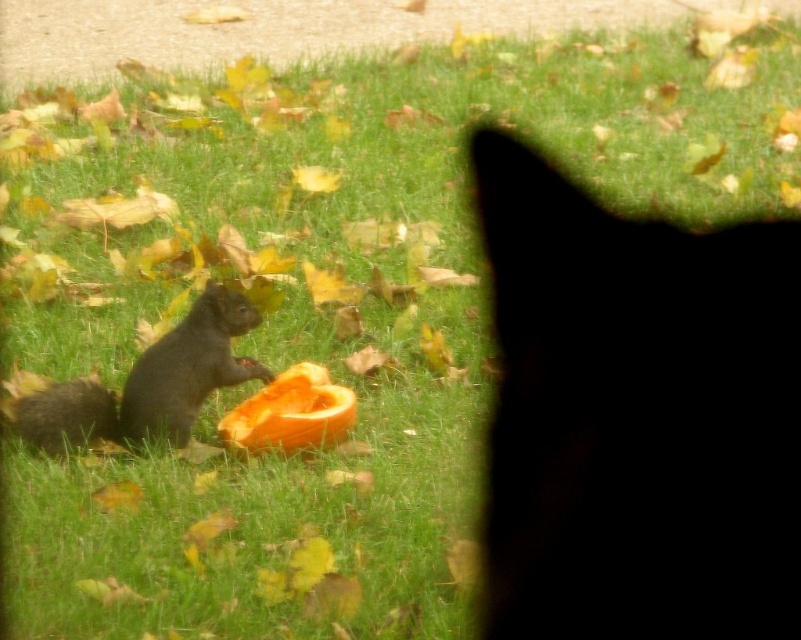
Locate an element on the screen. The image size is (801, 640). shiny brown squirrel at lower left is located at coordinates (149, 384).

From the picture: Can you confirm if shiny brown squirrel at lower left is thinner than orange matte pumpkin at center?

In fact, shiny brown squirrel at lower left might be wider than orange matte pumpkin at center.

Is point (187, 433) in front of point (302, 419)?

No.

The image size is (801, 640). What are the coordinates of `shiny brown squirrel at lower left` in the screenshot? It's located at (149, 384).

Is black matte fur at upper right closer to the viewer compared to shiny brown squirrel at lower left?

Yes, it is.

Is black matte fur at upper right bigger than shiny brown squirrel at lower left?

No.

Is point (706, 584) positioned before point (228, 304)?

That is True.

You are a GUI agent. You are given a task and a screenshot of the screen. Output one action in this format:
    pyautogui.click(x=<x>, y=<y>)
    Task: Click on the black matte fur at upper right
    
    Given the screenshot: What is the action you would take?
    pyautogui.click(x=636, y=416)

Who is lower down, black matte fur at upper right or orange matte pumpkin at center?

orange matte pumpkin at center is lower down.

Does black matte fur at upper right have a lesser width compared to orange matte pumpkin at center?

Yes, black matte fur at upper right is thinner than orange matte pumpkin at center.

What do you see at coordinates (636, 416) in the screenshot? I see `black matte fur at upper right` at bounding box center [636, 416].

Locate an element on the screen. black matte fur at upper right is located at coordinates (636, 416).